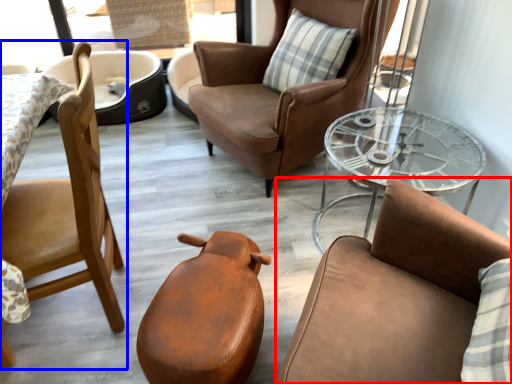
Question: Which object is further to the camera taking this photo, chair (highlighted by a red box) or chair (highlighted by a blue box)?

Choices:
 (A) chair
 (B) chair

Answer: (B)